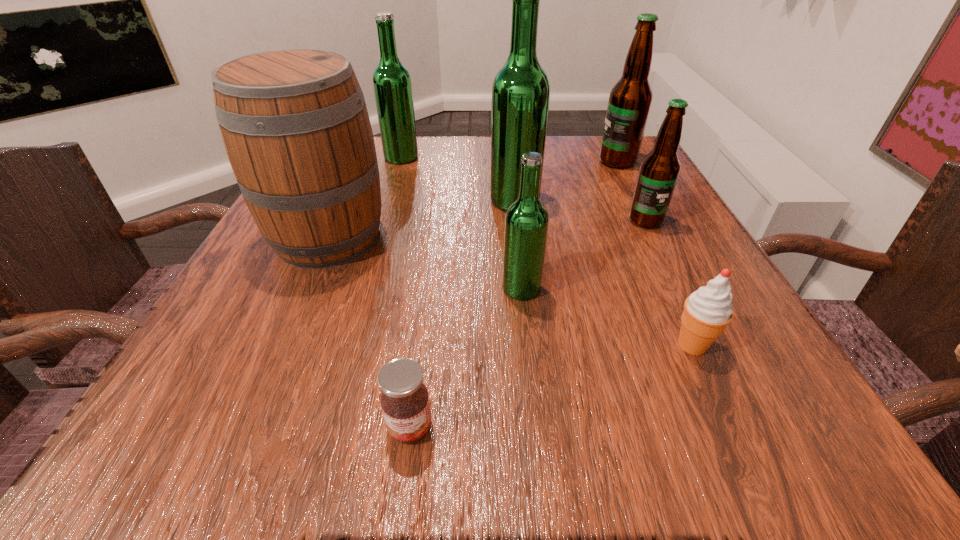
Where is `the second farthest green beer bottle`? the second farthest green beer bottle is located at coordinates (521, 89).

Locate an element on the screen. the biggest green beer bottle is located at coordinates (521, 89).

At what (x,y) coordinates should I click in order to perform the action: click on the bigger brown beer bottle. Please return your answer as a coordinate pair (x, y). Looking at the image, I should click on coord(630,99).

Where is `the leftmost green beer bottle`? The height and width of the screenshot is (540, 960). the leftmost green beer bottle is located at coordinates (392, 84).

Image resolution: width=960 pixels, height=540 pixels. What are the coordinates of `the farthest green beer bottle` in the screenshot? It's located at (392, 84).

What are the coordinates of `cider` in the screenshot? It's located at (294, 122).

Find the location of a particular element. The height and width of the screenshot is (540, 960). the smaller brown beer bottle is located at coordinates (659, 170).

The height and width of the screenshot is (540, 960). In order to click on the nearest green beer bottle in this screenshot , I will do `click(526, 223)`.

Identify the location of the third nearest object. Image resolution: width=960 pixels, height=540 pixels. (526, 223).

Identify the location of red icecream. (707, 311).